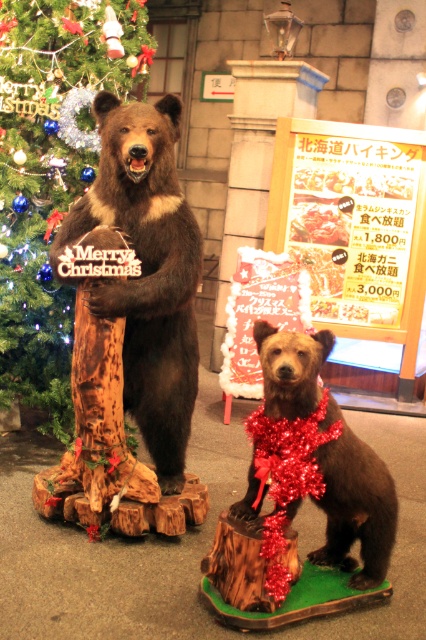
Between shiny brown bear at center and shiny red tinsel at center, which one is positioned higher?

shiny brown bear at center is above.

Which is behind, point (189, 422) or point (314, 371)?

The point (189, 422) is behind.

What are the coordinates of `shiny brown bear at center` in the screenshot? It's located at (146, 269).

This screenshot has height=640, width=426. What are the coordinates of `shiny brown bear at center` in the screenshot? It's located at (146, 269).

Which is below, green matte christmas tree at left or shiny brown bear at center?

Positioned lower is shiny brown bear at center.

Does green matte christmas tree at left appear over shiny brown bear at center?

Indeed, green matte christmas tree at left is positioned over shiny brown bear at center.

Does point (63, 184) lie in front of point (154, 198)?

No, it is not.

This screenshot has width=426, height=640. What are the coordinates of `green matte christmas tree at left` in the screenshot? It's located at (49, 176).

Which is more to the right, green matte christmas tree at left or shiny red tinsel at center?

From the viewer's perspective, shiny red tinsel at center appears more on the right side.

Can you confirm if green matte christmas tree at left is taller than shiny red tinsel at center?

Yes.

Image resolution: width=426 pixels, height=640 pixels. Find the location of `green matte christmas tree at left`. green matte christmas tree at left is located at coordinates (49, 176).